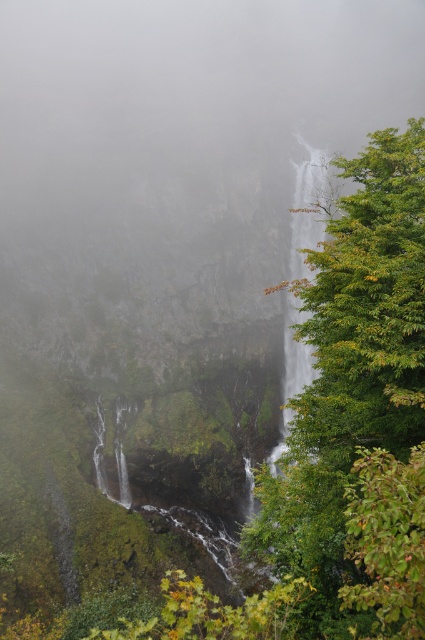
Is foggy mist at center above clear water at center?

Yes, foggy mist at center is above clear water at center.

Can you confirm if foggy mist at center is smaller than clear water at center?

Actually, foggy mist at center might be larger than clear water at center.

What are the coordinates of `foggy mist at center` in the screenshot? It's located at (175, 150).

Is foggy mist at center to the left of green leafy tree at right from the viewer's perspective?

Indeed, foggy mist at center is positioned on the left side of green leafy tree at right.

Between foggy mist at center and green leafy tree at right, which one has more height?

foggy mist at center is taller.

Where is `foggy mist at center`? foggy mist at center is located at coordinates (175, 150).

At what (x,y) coordinates should I click in order to perform the action: click on foggy mist at center. Please return your answer as a coordinate pair (x, y). Looking at the image, I should click on (175, 150).

In the scene shown: Between green leafy tree at right and clear water at center, which one has less height?

green leafy tree at right

Does green leafy tree at right come in front of clear water at center?

Yes, green leafy tree at right is closer to the viewer.

Measure the distance between point [342,362] and camera.

The distance of point [342,362] from camera is 26.96 feet.

I want to click on green leafy tree at right, so click(x=351, y=374).